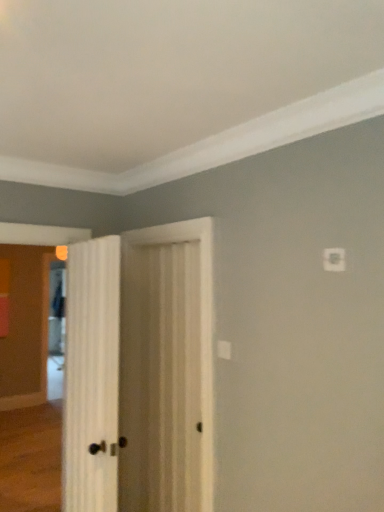
Question: Is white wood door at center, arranged as the first door when viewed from the left, taller or shorter than clear glass screen door at left?

Choices:
 (A) tall
 (B) short

Answer: (B)

Question: Is white wood door at center, arranged as the first door when viewed from the left, wider or thinner than clear glass screen door at left?

Choices:
 (A) wide
 (B) thin

Answer: (B)

Question: Which object is positioned closest to the clear glass screen door at left?

Choices:
 (A) white wood door at center, which is the 1th door in right-to-left order
 (B) white wood door at center, arranged as the first door when viewed from the left

Answer: (A)

Question: Based on their relative distances, which object is farther from the white wood door at center, arranged as the first door when viewed from the left?

Choices:
 (A) clear glass screen door at left
 (B) white wood door at center, which appears as the second door when viewed from the left

Answer: (A)